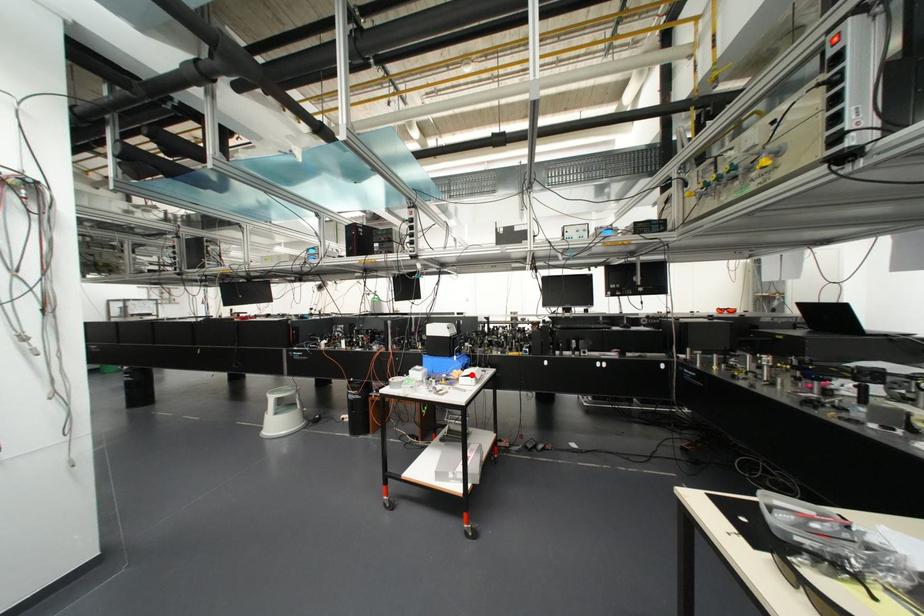
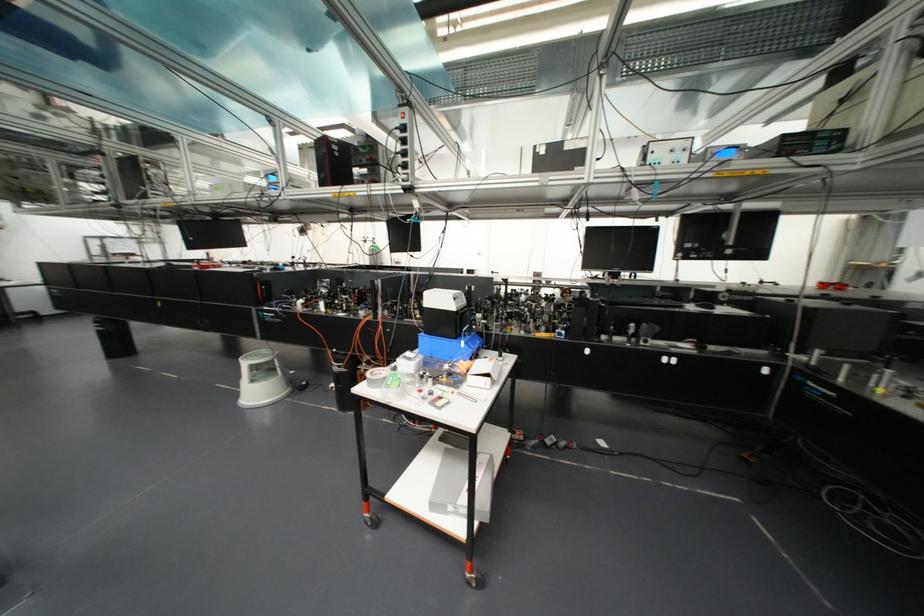
The point at the highlighted location is marked in the first image. Where is the corresponding point in the second image?

(487, 374)